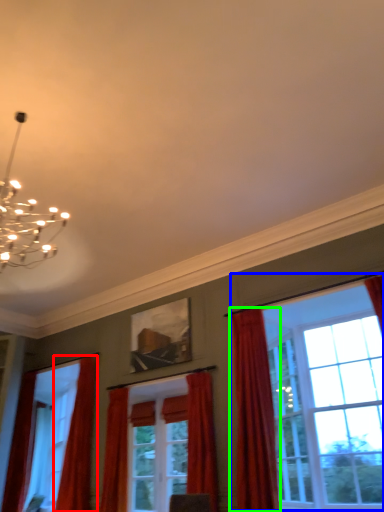
Question: Which object is positioned farthest from curtain (highlighted by a red box)? Select from window (highlighted by a blue box) and curtain (highlighted by a green box).

Choices:
 (A) window
 (B) curtain

Answer: (B)